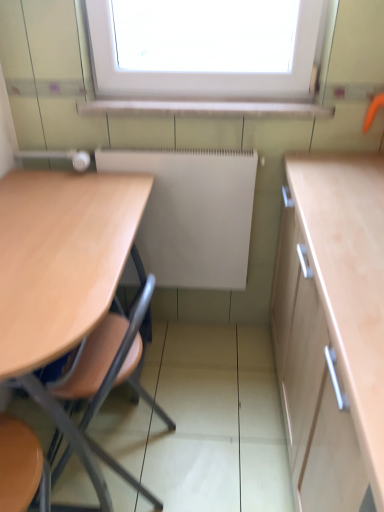
Question: Is point (230, 230) closer or farther from the camera than point (72, 287)?

Choices:
 (A) farther
 (B) closer

Answer: (A)

Question: Considering the positions of white matte radiator at center and light wood table at left in the image, is white matte radiator at center bigger or smaller than light wood table at left?

Choices:
 (A) big
 (B) small

Answer: (B)

Question: Considering the positions of white matte radiator at center and light wood table at left in the image, is white matte radiator at center taller or shorter than light wood table at left?

Choices:
 (A) short
 (B) tall

Answer: (A)

Question: From the image's perspective, relative to white matte radiator at center, is light wood table at left above or below?

Choices:
 (A) below
 (B) above

Answer: (A)

Question: Looking at the image, does light wood table at left seem bigger or smaller compared to white matte radiator at center?

Choices:
 (A) big
 (B) small

Answer: (A)

Question: Based on their positions, is light wood table at left located to the left or right of white matte radiator at center?

Choices:
 (A) left
 (B) right

Answer: (A)

Question: Is point (67, 349) closer or farther from the camera than point (125, 268)?

Choices:
 (A) closer
 (B) farther

Answer: (A)